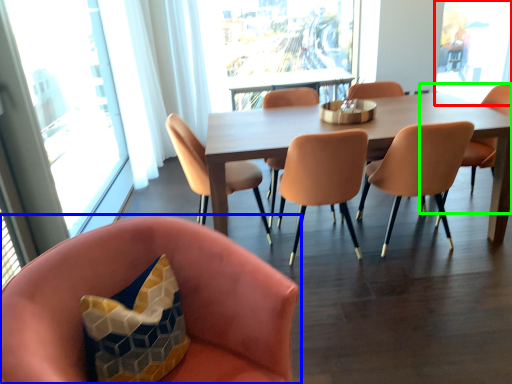
Question: Which object is the closest to the window screen (highlighted by a red box)? Choose among these: chair (highlighted by a blue box) or chair (highlighted by a green box).

Choices:
 (A) chair
 (B) chair

Answer: (B)